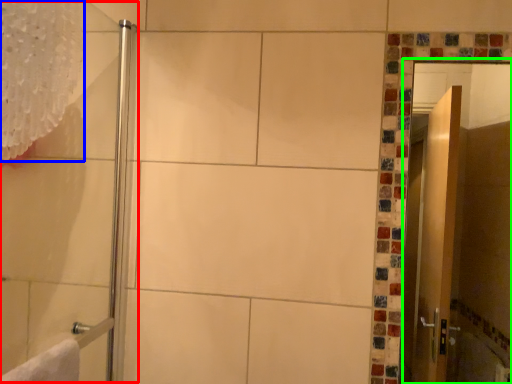
Question: Which object is the farthest from shower door (highlighted by a red box)? Choose among these: shower curtain (highlighted by a blue box) or screen door (highlighted by a green box).

Choices:
 (A) shower curtain
 (B) screen door

Answer: (B)